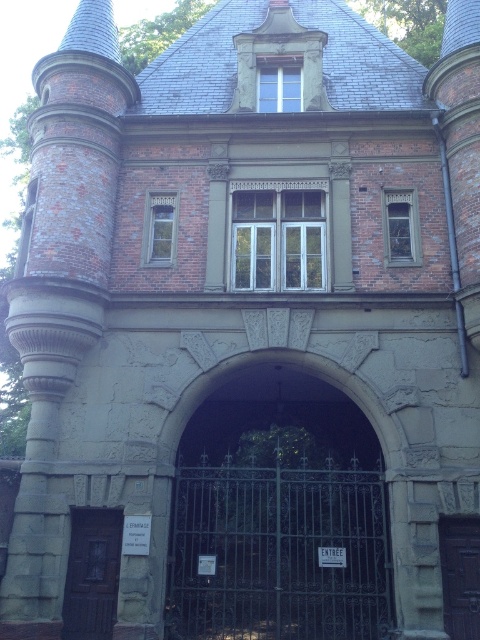
Question: Is dark gray wrought iron gate at center further to camera compared to brown wooden door at lower left?

Choices:
 (A) no
 (B) yes

Answer: (B)

Question: Can you confirm if dark gray wrought iron gate at center is positioned to the left of brown wooden door at lower left?

Choices:
 (A) yes
 (B) no

Answer: (B)

Question: Is dark gray wrought iron gate at center in front of dark brown wooden door at center?

Choices:
 (A) no
 (B) yes

Answer: (A)

Question: Which object is the farthest from the dark brown wooden door at center?

Choices:
 (A) brown wooden door at lower left
 (B) dark gray wrought iron gate at center

Answer: (A)

Question: Which point appears closest to the camera in this image?

Choices:
 (A) (70, 611)
 (B) (190, 564)

Answer: (A)

Question: Which object is closer to the camera taking this photo?

Choices:
 (A) brown wooden door at lower left
 (B) dark brown wooden door at center
 (C) dark gray wrought iron gate at center

Answer: (B)